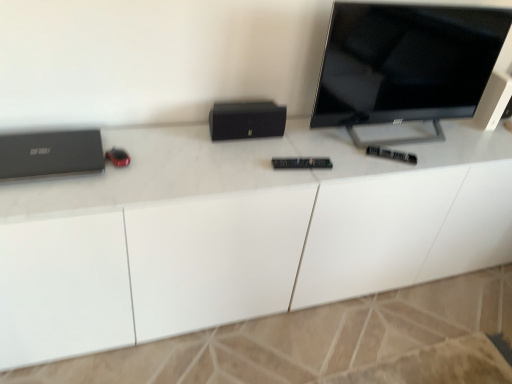
Question: Is black matte speaker at upper right bigger or smaller than black plastic remote at center?

Choices:
 (A) big
 (B) small

Answer: (A)

Question: Considering the relative positions of black matte speaker at upper right and black plastic remote at center in the image provided, is black matte speaker at upper right to the left or to the right of black plastic remote at center?

Choices:
 (A) right
 (B) left

Answer: (A)

Question: Considering the real-world distances, which object is closest to the black glossy tv at upper right?

Choices:
 (A) white glossy desk at center
 (B) matte black laptop at left
 (C) black matte speaker at center
 (D) black matte speaker at upper right
 (E) black plastic remote at center

Answer: (E)

Question: Estimate the real-world distances between objects in this image. Which object is closer to the black matte speaker at upper right?

Choices:
 (A) black matte speaker at center
 (B) white glossy desk at center
 (C) matte black laptop at left
 (D) black plastic remote at center
 (E) black glossy tv at upper right

Answer: (E)